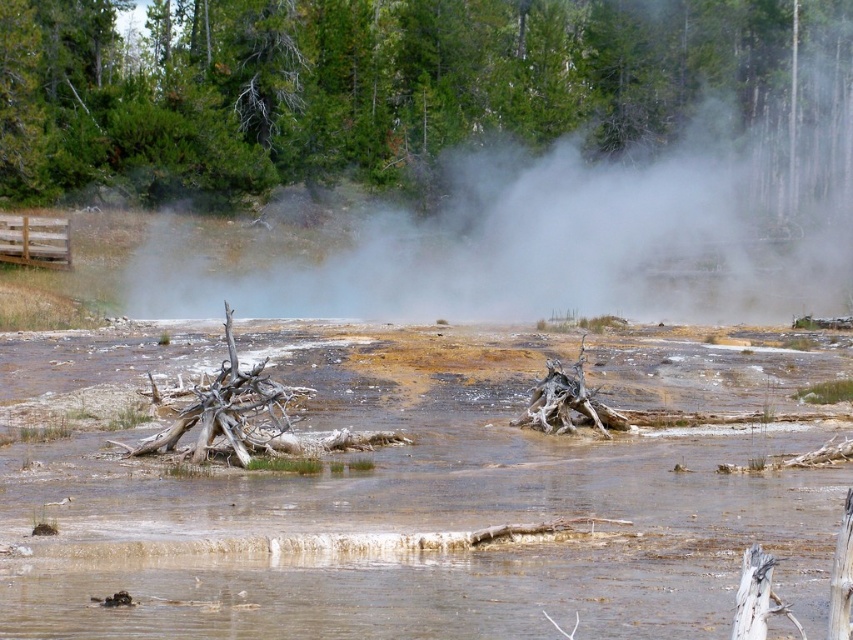
Which is behind, point (560, 467) or point (115, 109)?

The point (115, 109) is behind.

Who is lower down, brown muddy water at center or green textured tree at upper center?

brown muddy water at center is lower down.

Which is in front, point (195, 484) or point (757, 4)?

Point (195, 484) is in front.

Locate an element on the screen. brown muddy water at center is located at coordinates [416, 532].

Is brown muddy water at center in front of white vapor at upper center?

Yes, it is.

Locate an element on the screen. The image size is (853, 640). brown muddy water at center is located at coordinates 416,532.

Which is in front, point (306, 515) or point (601, 212)?

Point (306, 515) is in front.

I want to click on brown muddy water at center, so click(416, 532).

Who is taller, green textured tree at upper center or white vapor at upper center?

white vapor at upper center

Does point (668, 48) lie in front of point (839, 182)?

No, it is not.

Does point (86, 150) come behind point (630, 298)?

Yes, it is.

At what (x,y) coordinates should I click in order to perform the action: click on green textured tree at upper center. Please return your answer as a coordinate pair (x, y). The height and width of the screenshot is (640, 853). Looking at the image, I should click on (383, 84).